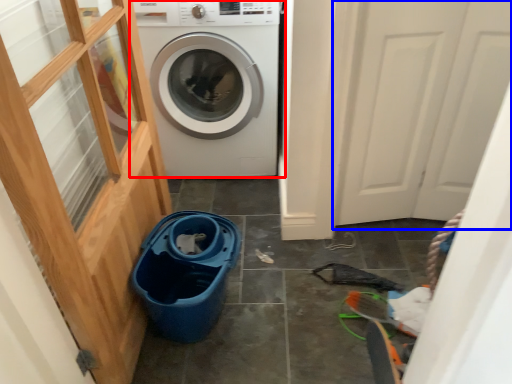
Question: Which object appears farthest to the camera in this image, washing machine (highlighted by a red box) or screen door (highlighted by a blue box)?

Choices:
 (A) washing machine
 (B) screen door

Answer: (A)